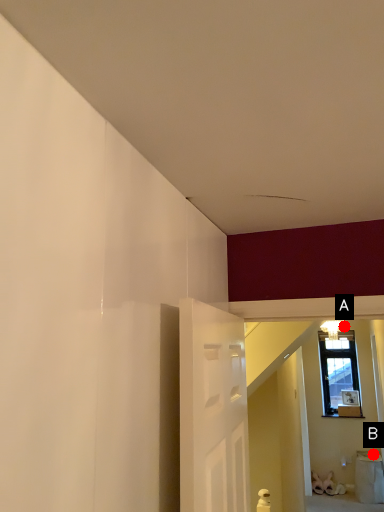
Question: Two points are circled on the image, labeled by A and B beside each circle. Which point appears closest to the camera in this image?

Choices:
 (A) A is closer
 (B) B is closer

Answer: (B)